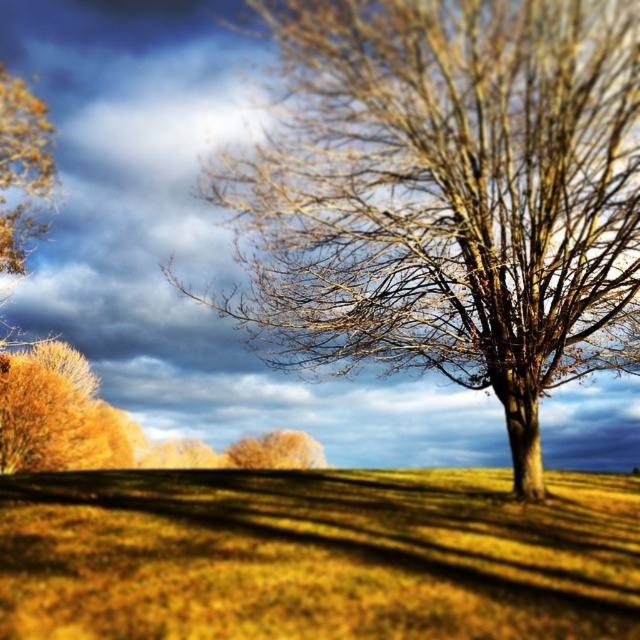
You are a hiker standing on the yellow grassy field at center and want to take a photo of the bare wood tree at center. Can you see the top of the tree from your current position?

The bare wood tree at center is taller than the yellow grassy field at center, so yes, you can see the top of the tree from your current position on the yellow grassy field at center.

You are planning to place a small garden bench in the scene. Based on the sizes of the yellow grassy field at center and the golden textured tree at center, which area would be more suitable for placing the bench to ensure it is not overwhelmed by the tree?

The yellow grassy field at center has a larger size compared to the golden textured tree at center, so placing the bench there would ensure it is not overwhelmed by the tree.

You are a hiker who wants to take a photo of the bare wood tree at center and the yellow grassy field at center. Which object should you focus on to ensure both are in the frame without moving the camera?

The bare wood tree at center has a smaller size compared to the yellow grassy field at center, so you should focus on the bare wood tree at center to ensure both are in the frame without moving the camera.